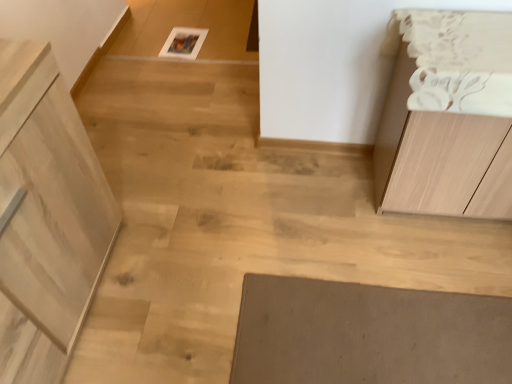
Locate an element on the screen. This screenshot has height=384, width=512. free location to the left of light wood cabinet at right, positioned as the second cabinetry in left-to-right order is located at coordinates (330, 217).